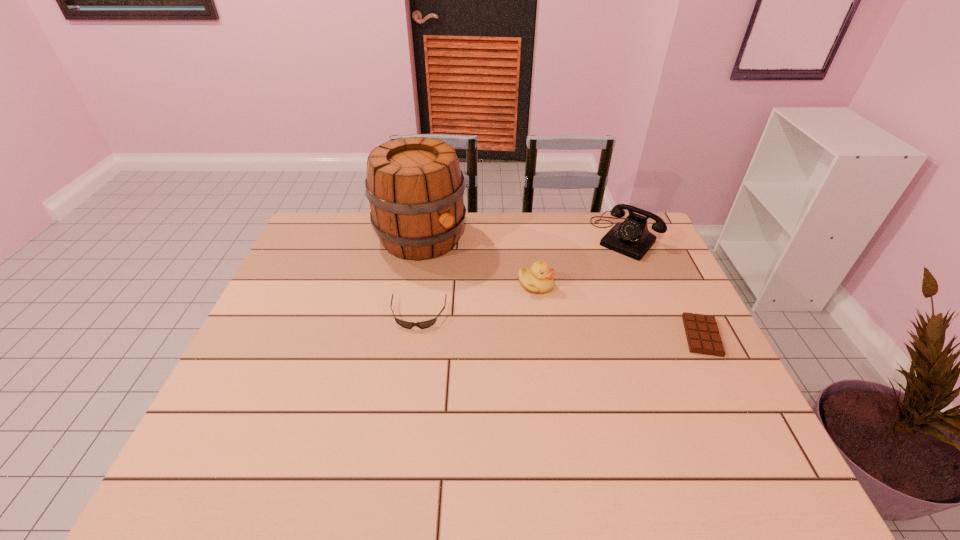
This screenshot has width=960, height=540. Identify the location of vacant space located 0.160m on the front face of the telephone. (591, 281).

Image resolution: width=960 pixels, height=540 pixels. I want to click on vacant area situated 0.200m on the side of the cider where the spigot is located, so click(487, 291).

Identify the location of vacant area located on the side of the cider where the spigot is located. (534, 329).

Identify the location of vacant space located 0.260m on the side of the cider where the spigot is located. Image resolution: width=960 pixels, height=540 pixels. (500, 302).

At what (x,y) coordinates should I click in order to perform the action: click on free space located on the beak of the third farthest object. Please return your answer as a coordinate pair (x, y). The height and width of the screenshot is (540, 960). Looking at the image, I should click on (654, 391).

The height and width of the screenshot is (540, 960). Find the location of `vacant space located on the beak of the third farthest object`. vacant space located on the beak of the third farthest object is located at coordinates (589, 333).

Where is `blank space located on the beak of the third farthest object`? Image resolution: width=960 pixels, height=540 pixels. blank space located on the beak of the third farthest object is located at coordinates (637, 377).

Identify the location of telephone that is at the far edge. Image resolution: width=960 pixels, height=540 pixels. (631, 237).

The width and height of the screenshot is (960, 540). What are the coordinates of `cider positioned at the far edge` in the screenshot? It's located at click(x=415, y=187).

Locate an element on the screen. candy bar at the right edge is located at coordinates (702, 333).